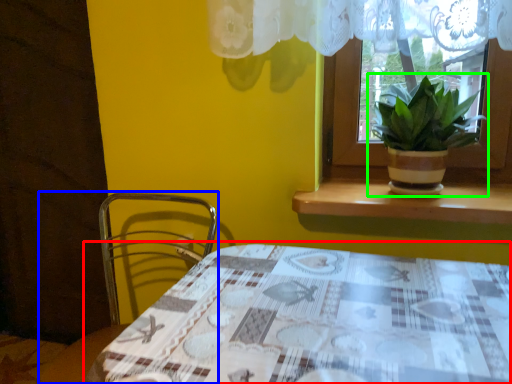
Question: Which object is the farthest from table (highlighted by a red box)? Choose among these: chair (highlighted by a blue box) or houseplant (highlighted by a green box).

Choices:
 (A) chair
 (B) houseplant

Answer: (A)